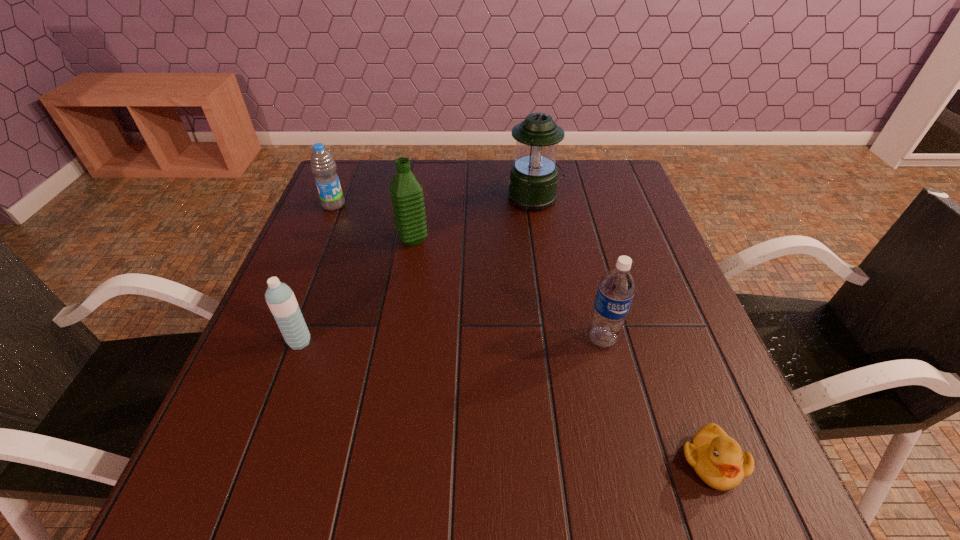
You are a GUI agent. You are given a task and a screenshot of the screen. Output one action in this format:
    pyautogui.click(x=<x>, y=<y>)
    Task: Click on the vacant area situated on the front of the farthest water bottle
    This screenshot has height=540, width=960.
    Given the screenshot: What is the action you would take?
    pyautogui.click(x=294, y=302)

Identify the location of lantern that is at the far edge. (533, 178).

You are a GUI agent. You are given a task and a screenshot of the screen. Output one action in this format:
    pyautogui.click(x=<x>, y=<y>)
    Task: Click on the water bottle at the far edge
    This screenshot has height=540, width=960.
    Given the screenshot: What is the action you would take?
    pyautogui.click(x=323, y=166)

The height and width of the screenshot is (540, 960). In order to click on object that is at the near edge in this screenshot , I will do pyautogui.click(x=718, y=460).

Image resolution: width=960 pixels, height=540 pixels. In order to click on object at the right edge in this screenshot , I will do `click(718, 460)`.

The width and height of the screenshot is (960, 540). What are the coordinates of `object at the far left corner` in the screenshot? It's located at (323, 166).

I want to click on object at the near right corner, so click(718, 460).

The height and width of the screenshot is (540, 960). In order to click on vacant space at the far edge of the desktop in this screenshot , I will do `click(425, 200)`.

The height and width of the screenshot is (540, 960). Identify the location of vacant space at the near edge of the desktop. (317, 494).

Where is `vacant space at the left edge of the desktop`? The width and height of the screenshot is (960, 540). vacant space at the left edge of the desktop is located at coordinates (x=323, y=293).